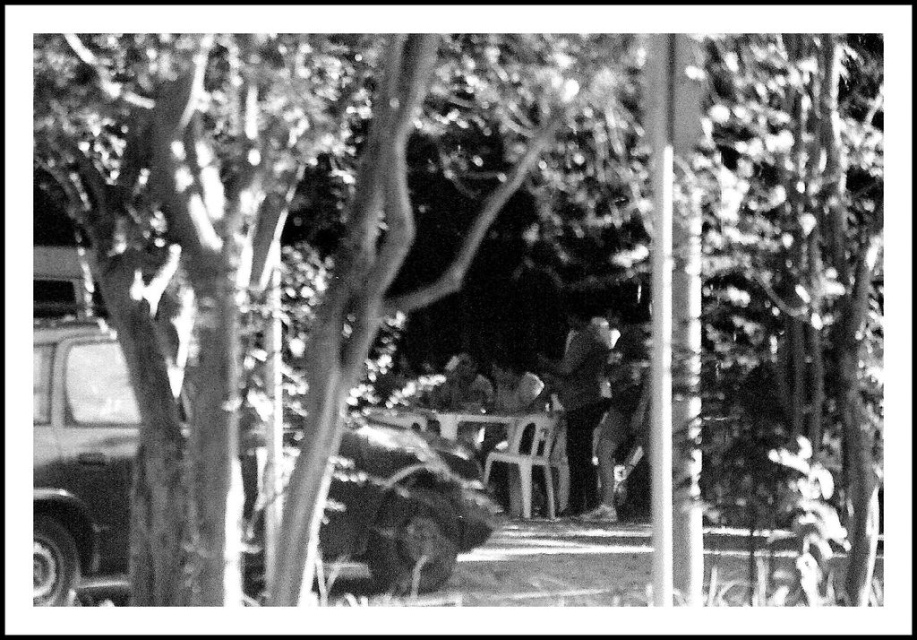
You are a photographer standing in the scene and want to take a picture of the dark matte car at left and the dark textured jacket at center. Which object should you focus on first if you want to ensure both are in focus?

The dark matte car at left is not as tall as the dark textured jacket at center, so you should focus on the dark textured jacket at center first to ensure both are in focus because it is closer to the camera.